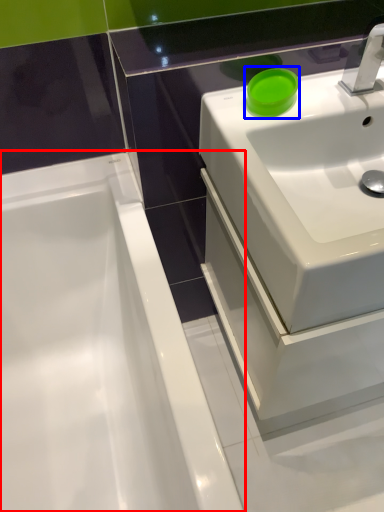
Question: Among these objects, which one is nearest to the camera, bathtub (highlighted by a red box) or teal (highlighted by a blue box)?

Choices:
 (A) bathtub
 (B) teal

Answer: (A)